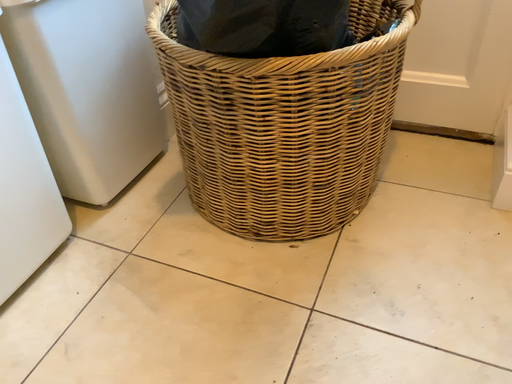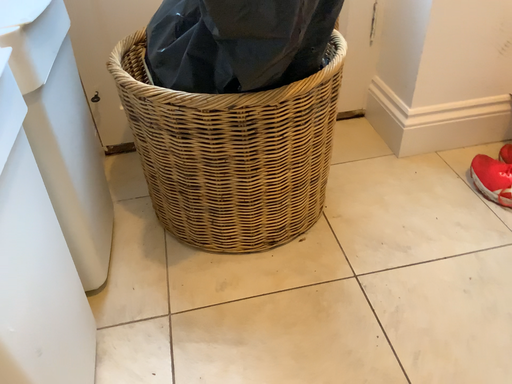
Question: Which way did the camera rotate in the video?

Choices:
 (A) rotated downward
 (B) rotated upward

Answer: (B)